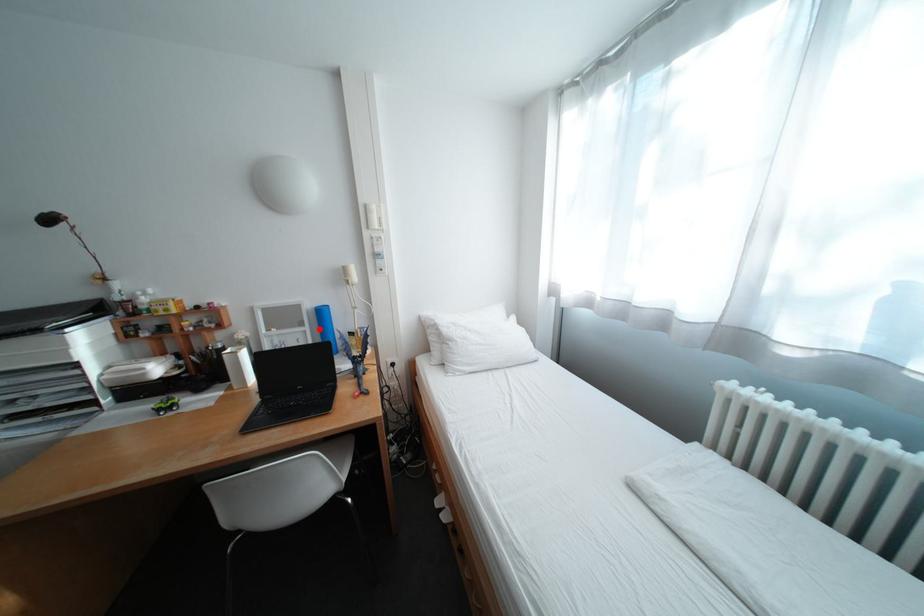
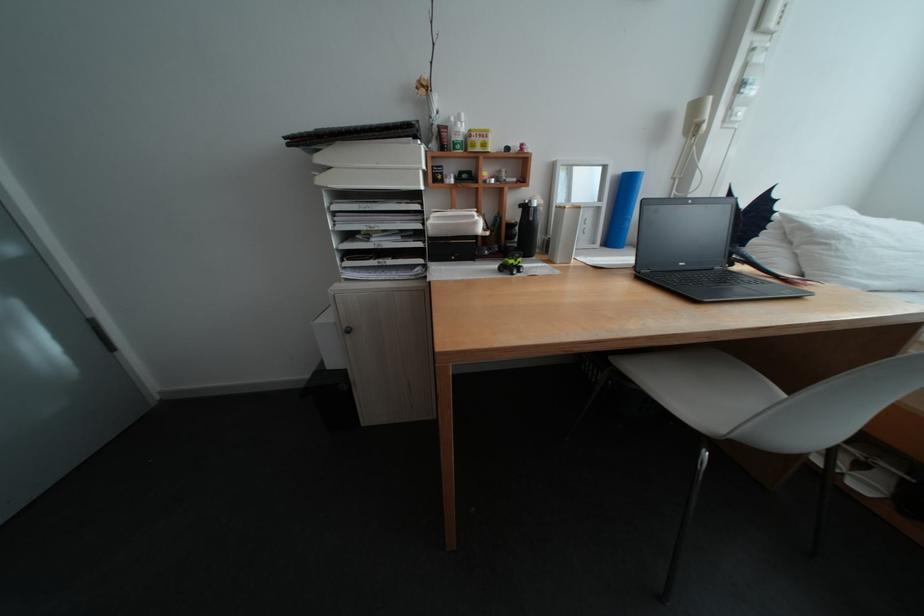
The point at the highlighted location is marked in the first image. Where is the corresponding point in the second image?

(616, 205)